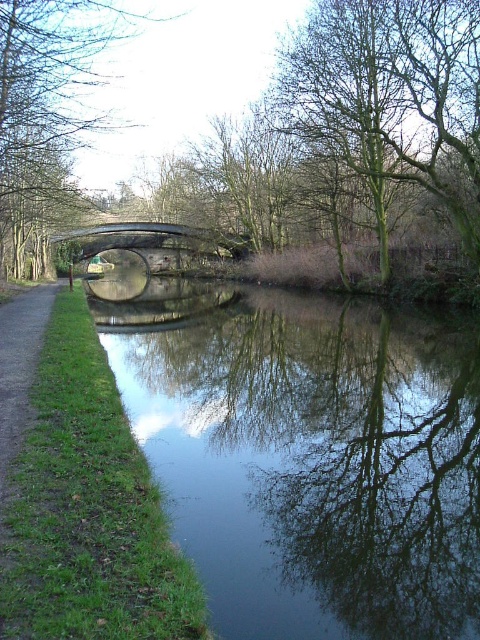
You are standing at the curved stone bridge and want to walk towards the paved path on the left side of the canal. There are two points marked on the path, point A at coordinates point A is point (97, 45) and point B at coordinates point B is point (116, 248). Which point should you walk towards to reach the path first?

You should walk towards point A at coordinates point A is point (97, 45) because it is in front of point B at coordinates point B is point (116, 248), meaning it is closer to your current position at the curved stone bridge.

You are a photographer standing on the paved path next to the canal. You want to take a photo of the metallic gray bridge at center without including the green leafy tree at left in the frame. Is it possible to do so based on their positions?

The green leafy tree at left is above the metallic gray bridge at center, so if you position yourself so that the camera is aimed directly at the bridge and not upward, you can avoid including the tree in the frame.